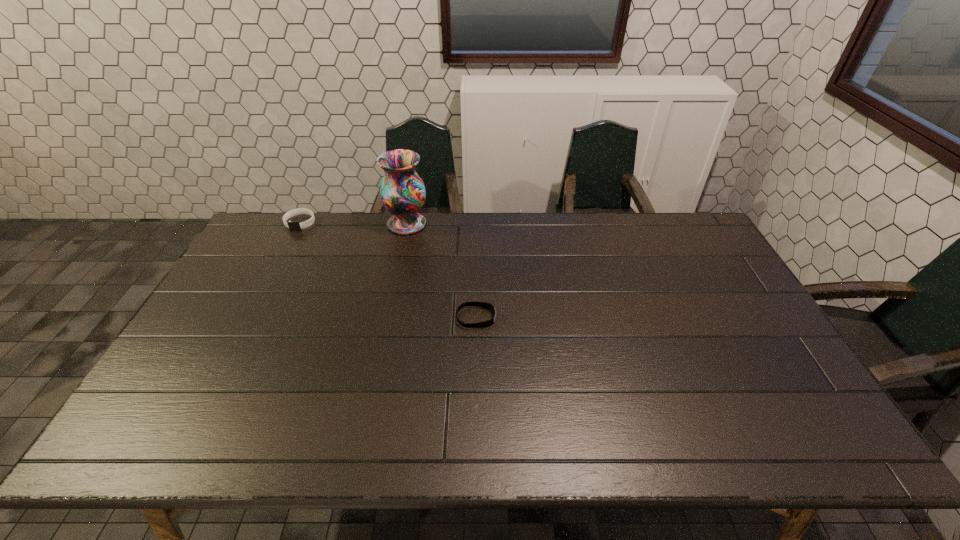
Where is `wristband situated at the far edge`? wristband situated at the far edge is located at coordinates (292, 225).

This screenshot has width=960, height=540. What are the coordinates of `object that is at the left edge` in the screenshot? It's located at (292, 225).

At what (x,y) coordinates should I click in order to perform the action: click on object that is at the far left corner. Please return your answer as a coordinate pair (x, y). The height and width of the screenshot is (540, 960). Looking at the image, I should click on (292, 225).

Where is `blank space at the far edge`? The height and width of the screenshot is (540, 960). blank space at the far edge is located at coordinates (611, 232).

In the image, there is a desktop. Where is `free space at the near edge`? free space at the near edge is located at coordinates (447, 446).

In the image, there is a desktop. What are the coordinates of `blank space at the left edge` in the screenshot? It's located at (215, 333).

Locate an element on the screen. vacant space at the right edge of the desktop is located at coordinates (783, 361).

Find the location of a particular element. This screenshot has height=540, width=960. vacant space at the far left corner is located at coordinates (280, 213).

Find the location of a particular element. This screenshot has height=540, width=960. vacant space at the far right corner is located at coordinates (677, 218).

This screenshot has height=540, width=960. In order to click on free space between the shorter wristband and the leftmost object in this screenshot , I will do `click(388, 271)`.